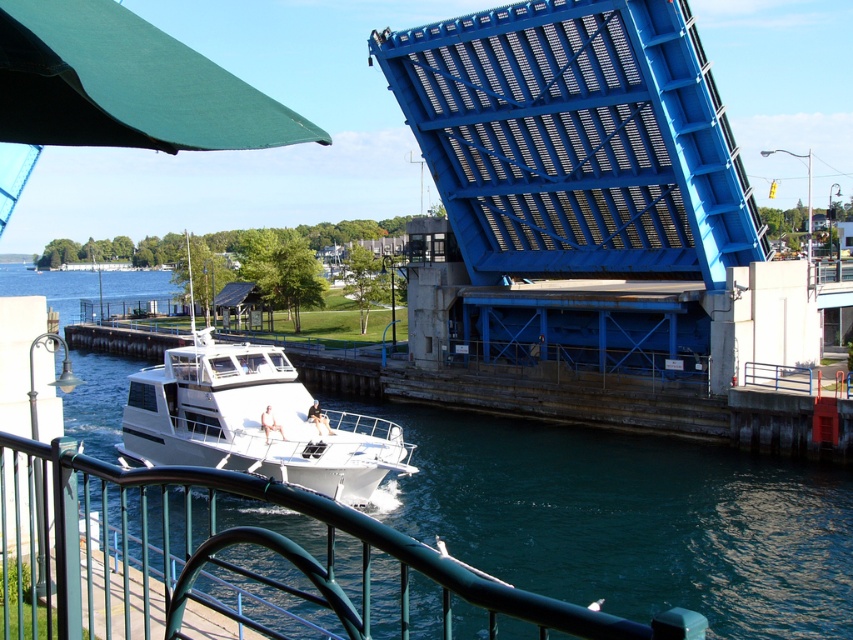
You are standing on the metallic green railing at lower center and want to observe the white glossy boat at center passing under the drawbridge. From your current position, which object is nearer to you?

The metallic green railing at lower center is closer to the viewer than the white glossy boat at center, so the railing is nearer to you.

You are standing on the dark green railing in the foreground of the waterfront scene. You notice a point marked at coordinates (x=630, y=518). Based on the scene, where is this point located?

The point (x=630, y=518) is on the blue metallic water at lower center.

You are standing on the dark green railing at the foreground and want to look at two points in the image, point [724,536] and point [363,490]. Which point will appear closer to you?

Point [724,536] is closer to the viewer than point [363,490], so it will appear closer to you.